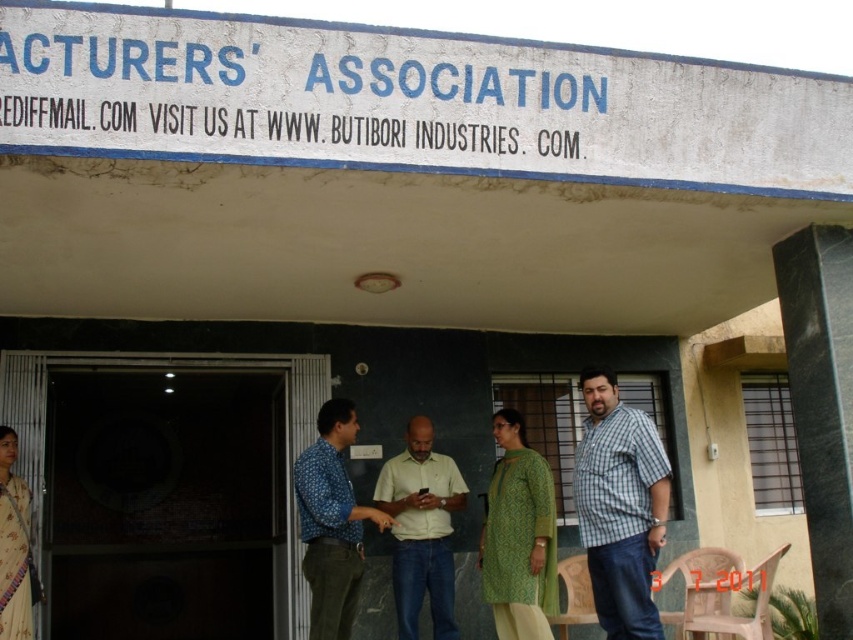
You are a visitor at the Manufacturers Association building and see the white concrete sign at upper center and the checkered fabric shirt at center. Which object is located higher up in the image?

The white concrete sign at upper center is positioned over the checkered fabric shirt at center, so it is higher up.

You are trying to decide which shirt to wear for a casual day out. You have two options in front of you at the entrance of the Manufacturers Association building. The checkered fabric shirt at center and the light beige cotton shirt at center. Which shirt is more suitable if you want something less bulky?

The checkered fabric shirt at center is thinner than the light beige cotton shirt at center, so it would be less bulky and more suitable for a casual day out.

You are a delivery person approaching the entrance of the Manufacturers Association building. You need to place a package on the ground near the white concrete sign at upper center and the light beige cotton shirt at center. Which object should you place the package closer to if you want it to be as far as possible from the other object?

You should place the package closer to the light beige cotton shirt at center because the white concrete sign at upper center is wider than the light beige cotton shirt at center, so positioning the package near the narrower object allows it to be farther from the wider one.